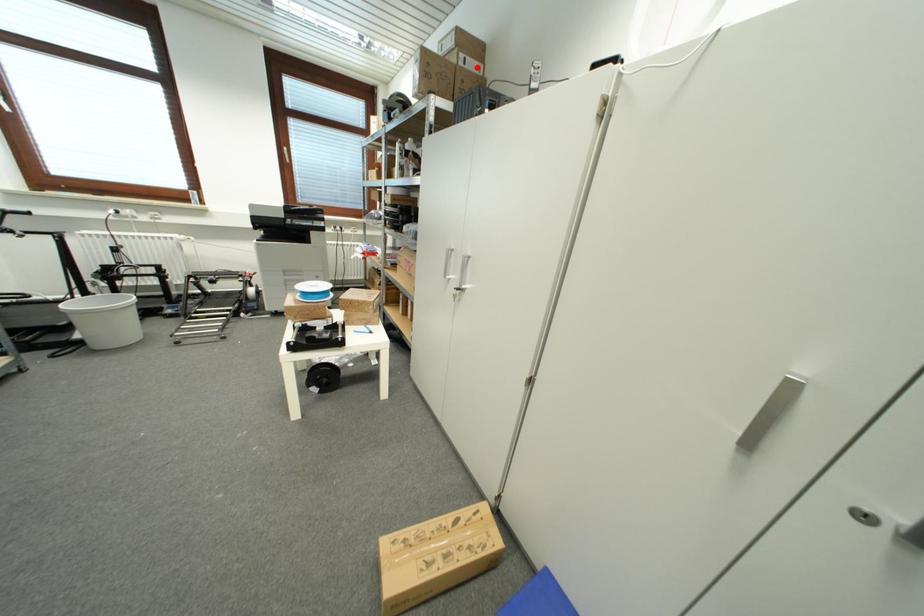
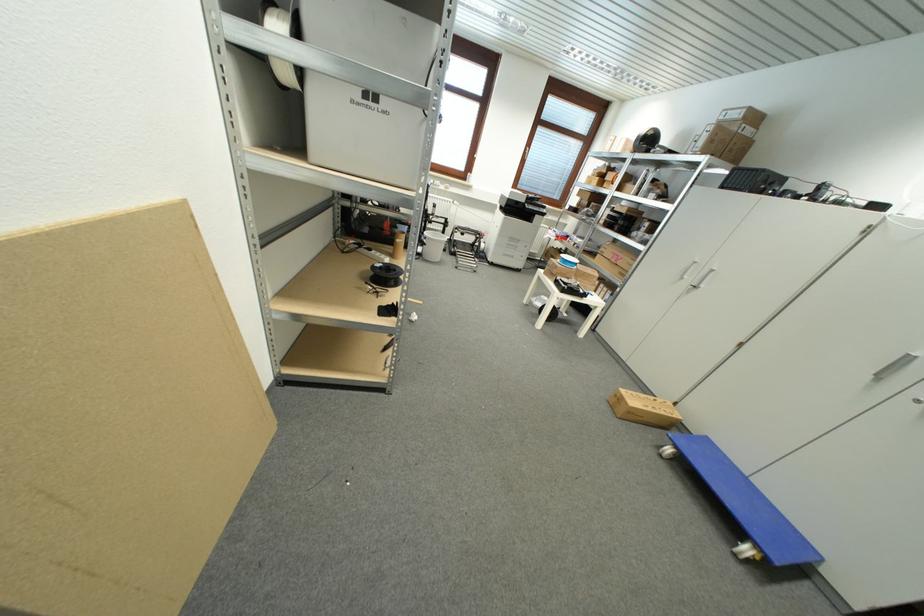
Question: I am providing you with two images of the same scene from different viewpoints. Image1 has a red point marked. In image2, the corresponding 3D location appears at what relative position? Reply with the corresponding letter.

Choices:
 (A) Closer
 (B) Farther

Answer: (B)